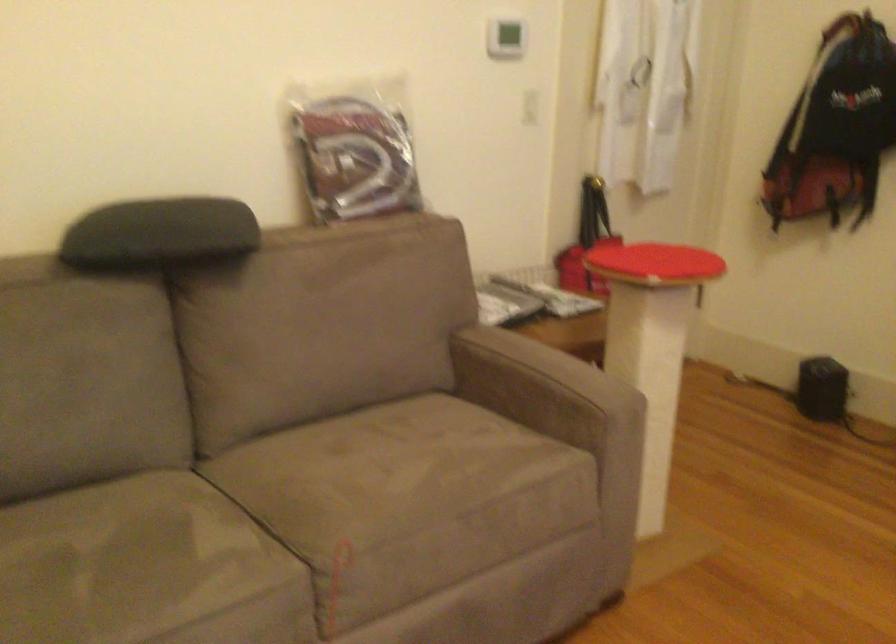
The width and height of the screenshot is (896, 644). I want to click on sofa armrest, so click(x=547, y=391).